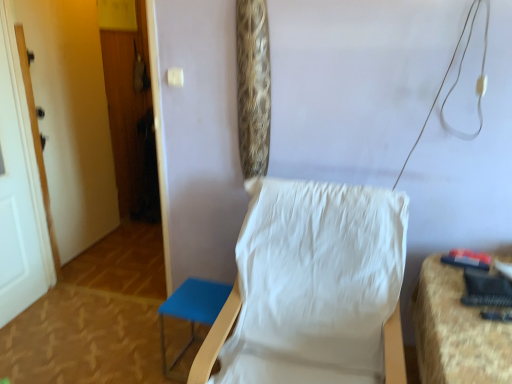
Locate an element on the screen. free spot above blue fabric stool at lower left, the 1th furniture viewed from the left (from a real-world perspective) is located at coordinates (197, 299).